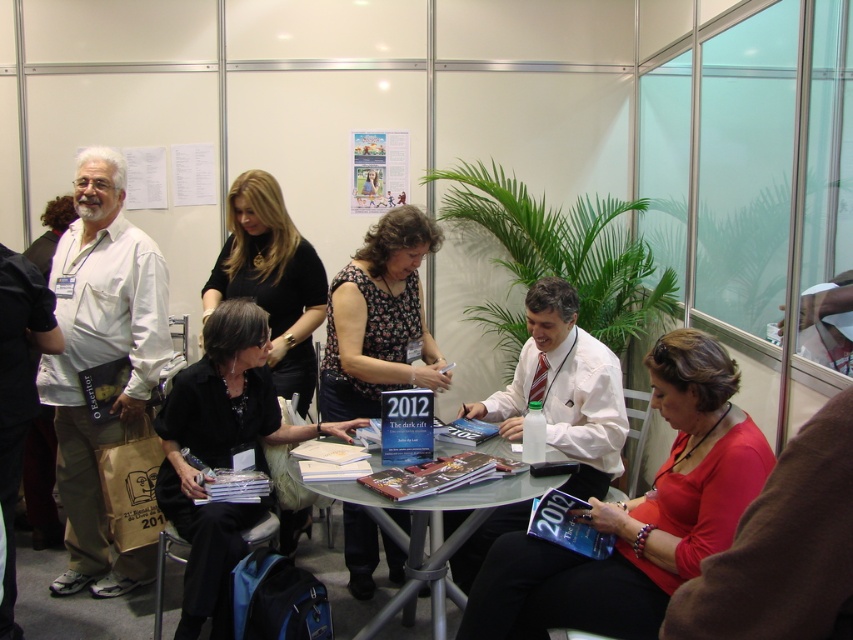
Which of these two, floral print blouse at center or clear glass table at center, stands taller?

Standing taller between the two is floral print blouse at center.

Does floral print blouse at center have a smaller size compared to clear glass table at center?

Yes.

Is point (380, 246) behind point (396, 625)?

No.

Identify the location of floral print blouse at center. (379, 320).

Is black matte shirt at center positioned behind black fabric shirt at center?

No, black matte shirt at center is closer to the viewer.

Does black matte shirt at center have a lesser height compared to black fabric shirt at center?

In fact, black matte shirt at center may be taller than black fabric shirt at center.

Locate an element on the screen. The height and width of the screenshot is (640, 853). black matte shirt at center is located at coordinates (219, 452).

Can you confirm if matte red shirt at center is positioned above clear glass table at center?

Yes.

Who is more distant from viewer, (497, 637) or (390, 612)?

The point (390, 612) is behind.

Which is behind, point (616, 518) or point (451, 600)?

Point (451, 600)

The width and height of the screenshot is (853, 640). What are the coordinates of `matte red shirt at center` in the screenshot? It's located at (637, 515).